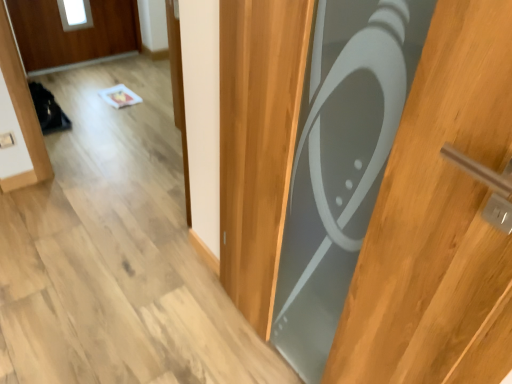
Question: Is white plastic electric outlet at lower left at the back of matte gray door at center?

Choices:
 (A) yes
 (B) no

Answer: (B)

Question: Considering the relative sizes of matte gray door at center and white plastic electric outlet at lower left in the image provided, is matte gray door at center bigger than white plastic electric outlet at lower left?

Choices:
 (A) yes
 (B) no

Answer: (A)

Question: Does matte gray door at center appear on the left side of white plastic electric outlet at lower left?

Choices:
 (A) yes
 (B) no

Answer: (B)

Question: From a real-world perspective, is matte gray door at center physically below white plastic electric outlet at lower left?

Choices:
 (A) no
 (B) yes

Answer: (A)

Question: Does matte gray door at center have a greater height compared to white plastic electric outlet at lower left?

Choices:
 (A) no
 (B) yes

Answer: (B)

Question: Is matte gray door at center behind white plastic electric outlet at lower left?

Choices:
 (A) no
 (B) yes

Answer: (A)

Question: From a real-world perspective, is white plastic electric outlet at lower left positioned under matte gray door at center based on gravity?

Choices:
 (A) yes
 (B) no

Answer: (A)

Question: Can you confirm if white plastic electric outlet at lower left is taller than matte gray door at center?

Choices:
 (A) no
 (B) yes

Answer: (A)

Question: Would you consider white plastic electric outlet at lower left to be distant from matte gray door at center?

Choices:
 (A) no
 (B) yes

Answer: (B)

Question: Can you confirm if white plastic electric outlet at lower left is smaller than matte gray door at center?

Choices:
 (A) yes
 (B) no

Answer: (A)

Question: Can you confirm if white plastic electric outlet at lower left is thinner than matte gray door at center?

Choices:
 (A) yes
 (B) no

Answer: (A)

Question: Is white plastic electric outlet at lower left facing towards matte gray door at center?

Choices:
 (A) yes
 (B) no

Answer: (A)

Question: Is matte gray door at center wider or thinner than white plastic electric outlet at lower left?

Choices:
 (A) thin
 (B) wide

Answer: (B)